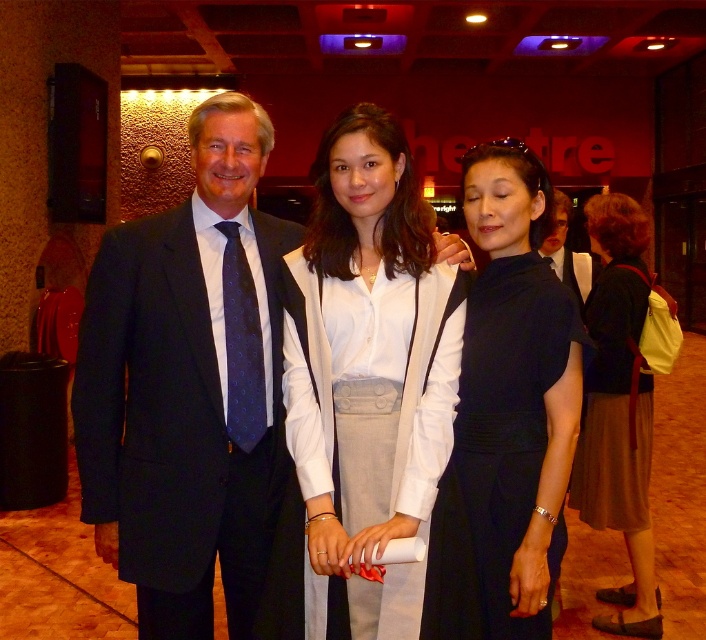
You are a photographer at the event and need to adjust the lighting so that both the white cotton blouse at center and the black satin dress at center are equally illuminated. Given their current positions, is it feasible to achieve this without moving either garment? Please explain your reasoning.

The white cotton blouse at center and the black satin dress at center are 8.75 inches apart. Since the distance between them is manageable, adjusting the lighting angles or intensities can ensure both garments receive equal illumination without needing to move them.

You are a photographer adjusting your camera settings to focus on the two central figures. Which clothing item, the white cotton blouse at center or the black satin dress at center, is positioned higher relative to the other?

The white cotton blouse at center is positioned higher than the black satin dress at center.